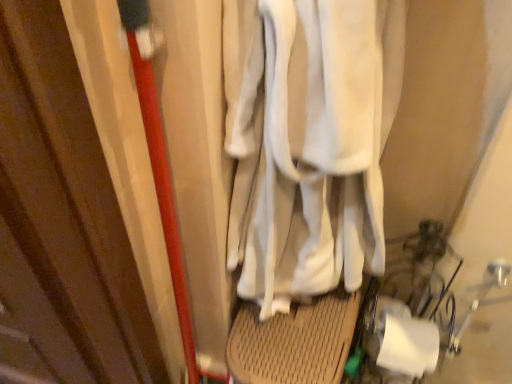
Measure the distance between point (391, 364) and camera.

Point (391, 364) is 36.61 inches from camera.

At what (x,y) coordinates should I click in order to perform the action: click on white matte toilet paper at lower right. Please return your answer as a coordinate pair (x, y). The image size is (512, 384). Looking at the image, I should click on (409, 346).

What do you see at coordinates (409, 346) in the screenshot? The image size is (512, 384). I see `white matte toilet paper at lower right` at bounding box center [409, 346].

At what (x,y) coordinates should I click in order to perform the action: click on white matte toilet paper at lower right. Please return your answer as a coordinate pair (x, y). The height and width of the screenshot is (384, 512). Looking at the image, I should click on (409, 346).